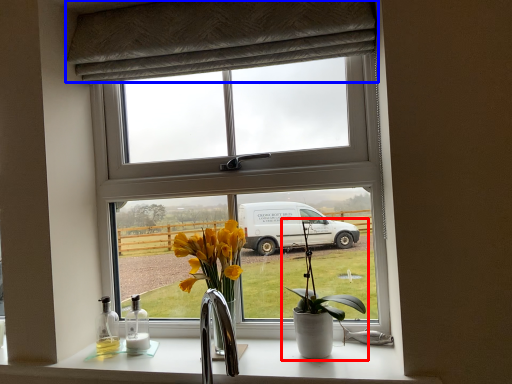
Question: Among these objects, which one is farthest to the camera, houseplant (highlighted by a red box) or curtain (highlighted by a blue box)?

Choices:
 (A) houseplant
 (B) curtain

Answer: (B)